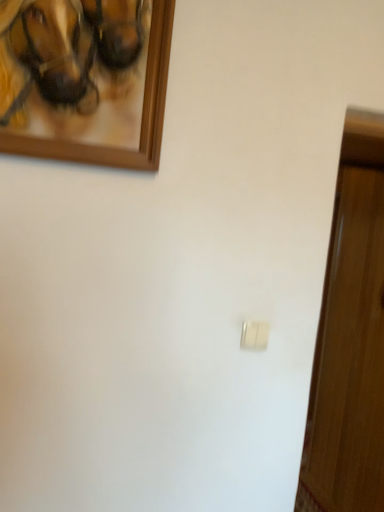
Question: Could you tell me if wooden picture frame at upper left is facing white plastic light switch at center?

Choices:
 (A) yes
 (B) no

Answer: (B)

Question: Can you confirm if wooden picture frame at upper left is thinner than white plastic light switch at center?

Choices:
 (A) yes
 (B) no

Answer: (B)

Question: Is wooden picture frame at upper left positioned before white plastic light switch at center?

Choices:
 (A) no
 (B) yes

Answer: (B)

Question: Is there a large distance between wooden picture frame at upper left and white plastic light switch at center?

Choices:
 (A) no
 (B) yes

Answer: (A)

Question: Does wooden picture frame at upper left appear on the right side of white plastic light switch at center?

Choices:
 (A) yes
 (B) no

Answer: (B)

Question: From the image's perspective, is wooden picture frame at upper left beneath white plastic light switch at center?

Choices:
 (A) no
 (B) yes

Answer: (A)

Question: Is white plastic light switch at center at the right side of wooden picture frame at upper left?

Choices:
 (A) no
 (B) yes

Answer: (B)

Question: From a real-world perspective, is white plastic light switch at center under wooden picture frame at upper left?

Choices:
 (A) yes
 (B) no

Answer: (A)

Question: Is the position of white plastic light switch at center less distant than that of wooden picture frame at upper left?

Choices:
 (A) no
 (B) yes

Answer: (A)

Question: Can you confirm if white plastic light switch at center is bigger than wooden picture frame at upper left?

Choices:
 (A) yes
 (B) no

Answer: (B)

Question: Does white plastic light switch at center have a lesser width compared to wooden picture frame at upper left?

Choices:
 (A) yes
 (B) no

Answer: (A)

Question: From a real-world perspective, is white plastic light switch at center on top of wooden picture frame at upper left?

Choices:
 (A) yes
 (B) no

Answer: (B)

Question: From the image's perspective, is wooden picture frame at upper left positioned above or below white plastic light switch at center?

Choices:
 (A) below
 (B) above

Answer: (B)